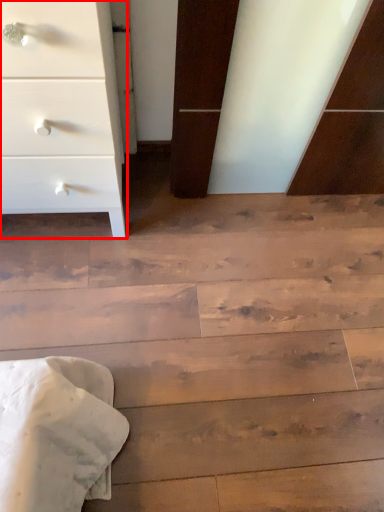
Question: From the image's perspective, where is chest of drawers (annotated by the red box) located in relation to stairwell in the image?

Choices:
 (A) below
 (B) above

Answer: (B)